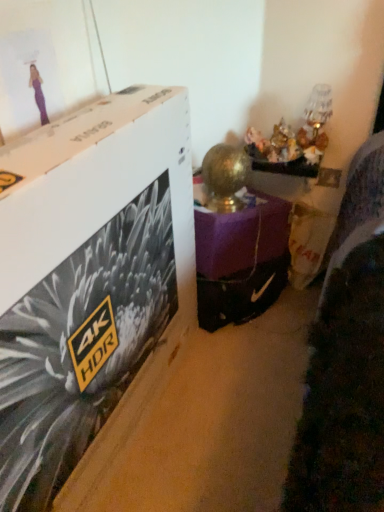
Locate an element on the screen. The width and height of the screenshot is (384, 512). vacant region above white cardboard box at upper left (from a real-world perspective) is located at coordinates (86, 124).